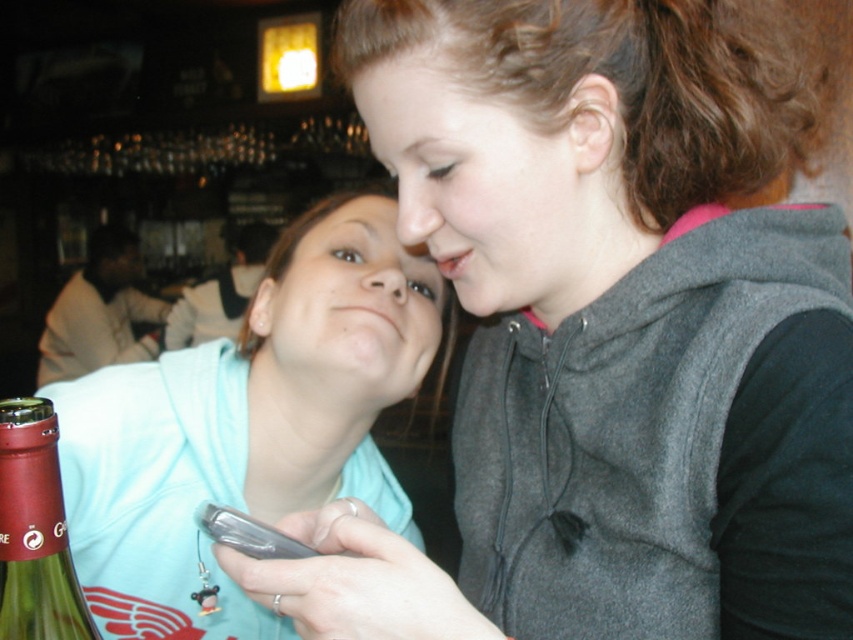
Question: Which point is farther to the camera?

Choices:
 (A) light blue hoodie at center
 (B) green glass bottle at lower left

Answer: (A)

Question: Where is light blue hoodie at center located in relation to green glass bottle at lower left in the image?

Choices:
 (A) right
 (B) left

Answer: (A)

Question: Can you confirm if light blue hoodie at center is positioned above green glass bottle at lower left?

Choices:
 (A) no
 (B) yes

Answer: (B)

Question: Among these objects, which one is farthest from the camera?

Choices:
 (A) light blue hoodie at center
 (B) green glass bottle at lower left

Answer: (A)

Question: Which of the following is the closest to the observer?

Choices:
 (A) (294, 435)
 (B) (45, 531)

Answer: (B)

Question: Can you confirm if light blue hoodie at center is positioned below green glass bottle at lower left?

Choices:
 (A) yes
 (B) no

Answer: (B)